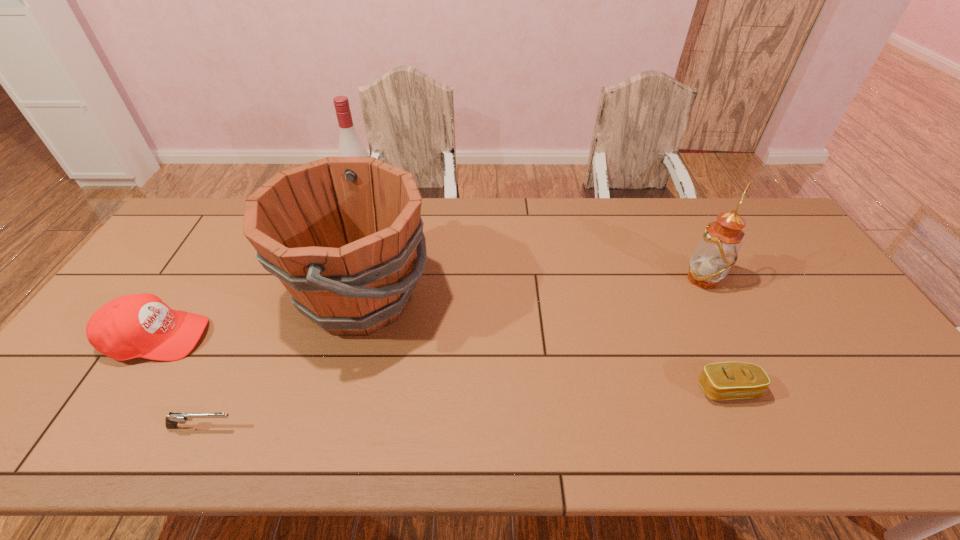
This screenshot has height=540, width=960. In order to click on empty location between the fourth tallest object and the farthest object in this screenshot , I will do `click(260, 272)`.

Locate an element on the screen. This screenshot has width=960, height=540. free space between the leftmost object and the pistol is located at coordinates (180, 382).

At what (x,y) coordinates should I click in order to perform the action: click on vacant region between the alcohol and the oil lamp. Please return your answer as a coordinate pair (x, y). The image size is (960, 540). Looking at the image, I should click on (534, 242).

Where is `unoccupied area between the nearest object and the alcohol`? unoccupied area between the nearest object and the alcohol is located at coordinates (283, 316).

This screenshot has width=960, height=540. Find the location of `free point between the second nearest object and the third shortest object`. free point between the second nearest object and the third shortest object is located at coordinates (443, 363).

This screenshot has width=960, height=540. Find the location of `free space between the oil lamp and the leftmost object`. free space between the oil lamp and the leftmost object is located at coordinates (430, 308).

Where is `free spot between the oil lamp and the fifth farthest object`? Image resolution: width=960 pixels, height=540 pixels. free spot between the oil lamp and the fifth farthest object is located at coordinates (716, 334).

Locate an element on the screen. The height and width of the screenshot is (540, 960). unoccupied area between the second nearest object and the bucket is located at coordinates (544, 343).

Where is `free space between the oil lamp and the alcohol`? The image size is (960, 540). free space between the oil lamp and the alcohol is located at coordinates (534, 242).

Locate an element on the screen. This screenshot has width=960, height=540. free space that is in between the oil lamp and the bucket is located at coordinates (532, 288).